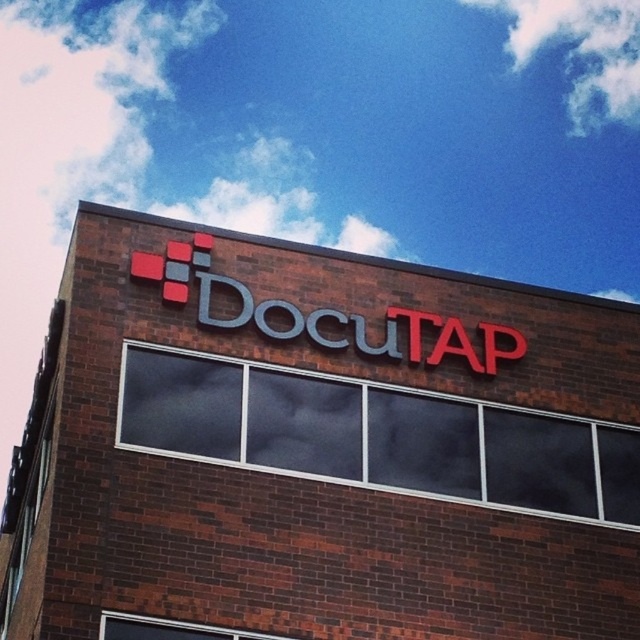
Question: Can you confirm if metallic sign at center is positioned below matte plastic sign at upper center?

Choices:
 (A) yes
 (B) no

Answer: (A)

Question: Does metallic sign at center appear under matte plastic sign at upper center?

Choices:
 (A) no
 (B) yes

Answer: (B)

Question: Can you confirm if metallic sign at center is positioned below matte plastic sign at upper center?

Choices:
 (A) no
 (B) yes

Answer: (B)

Question: Among these objects, which one is farthest from the camera?

Choices:
 (A) metallic sign at center
 (B) matte plastic sign at upper center

Answer: (B)

Question: Among these points, which one is nearest to the camera?

Choices:
 (A) (221, 593)
 (B) (205, 323)

Answer: (A)